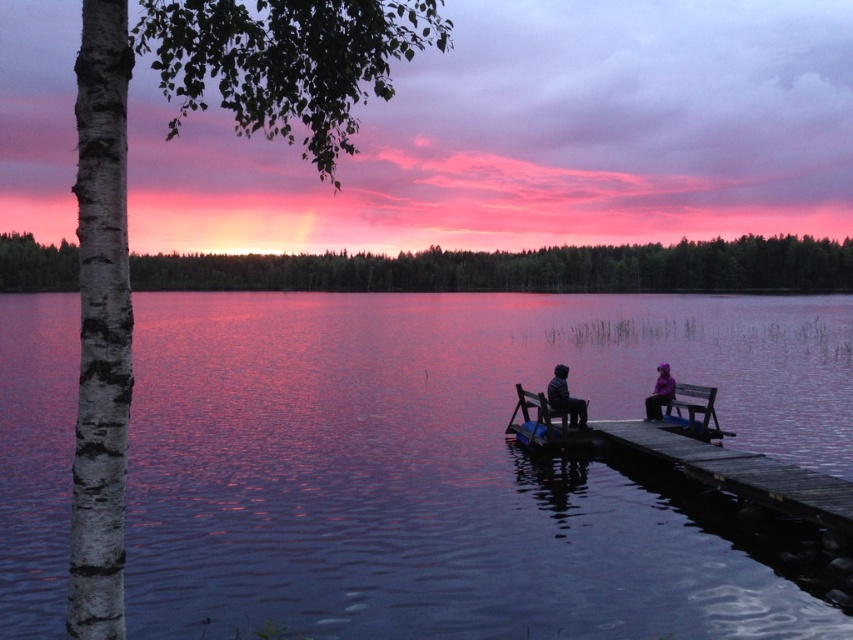
Question: Is white textured birch tree at left above wooden bench at lower right?

Choices:
 (A) no
 (B) yes

Answer: (B)

Question: Is white bark birch tree at left to the right of wooden dock at lower right from the viewer's perspective?

Choices:
 (A) no
 (B) yes

Answer: (A)

Question: Considering the real-world distances, which object is farthest from the purple fabric jacket at lower right?

Choices:
 (A) wooden bench at lower right
 (B) wooden dock at lower right

Answer: (B)

Question: Is matte black bench at center below purple fabric jacket at lower right?

Choices:
 (A) no
 (B) yes

Answer: (A)

Question: Which of the following is the farthest from the observer?

Choices:
 (A) wooden dock at lower right
 (B) wooden bench at lower right
 (C) purple fabric jacket at lower right
 (D) white bark birch tree at left

Answer: (C)

Question: Among these points, which one is nearest to the camera?

Choices:
 (A) (689, 420)
 (B) (577, 410)
 (C) (799, 472)

Answer: (C)